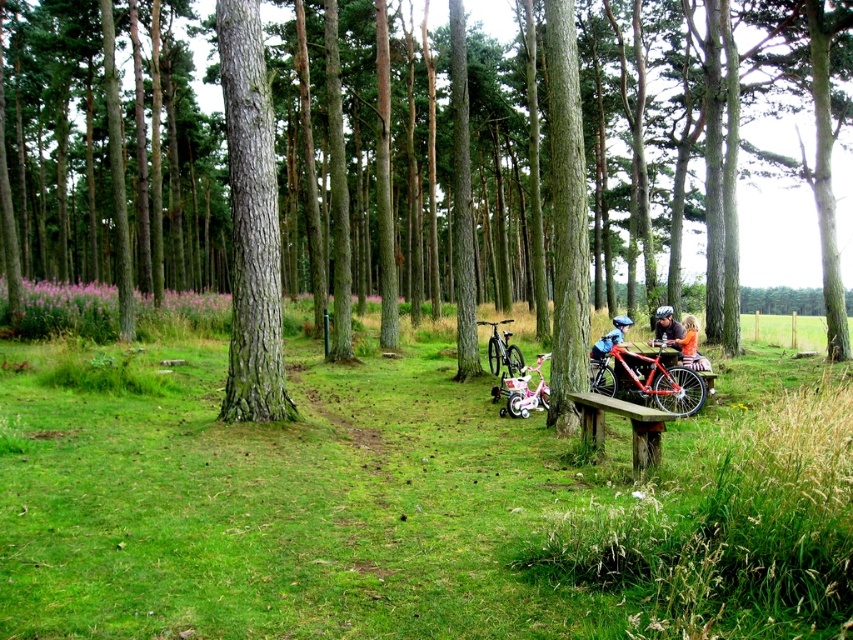
Question: Which point is farther to the camera?

Choices:
 (A) [523, 371]
 (B) [672, 419]
 (C) [236, 208]

Answer: (A)

Question: Is green rough bark tree at center positioned behind shiny silver mountain bike at center?

Choices:
 (A) no
 (B) yes

Answer: (A)

Question: Does green rough bark tree at center have a larger size compared to smooth brown tree trunk at center?

Choices:
 (A) yes
 (B) no

Answer: (A)

Question: Among these objects, which one is nearest to the camera?

Choices:
 (A) metallic silver bicycle at center
 (B) shiny silver mountain bike at center

Answer: (A)

Question: Considering the real-world distances, which object is closest to the metallic silver bicycle at center?

Choices:
 (A) wooden bench at lower right
 (B) green rough bark tree at center
 (C) shiny red mountain bike at right

Answer: (C)

Question: Observing the image, what is the correct spatial positioning of metallic bicycle at center in reference to shiny red mountain bike at right?

Choices:
 (A) left
 (B) right

Answer: (A)